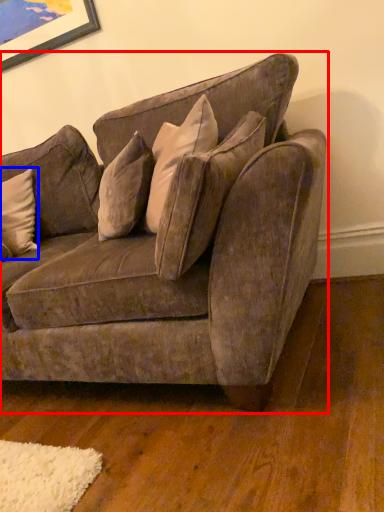
Question: Which object appears farthest to the camera in this image, studio couch (highlighted by a red box) or pillow (highlighted by a blue box)?

Choices:
 (A) studio couch
 (B) pillow

Answer: (B)